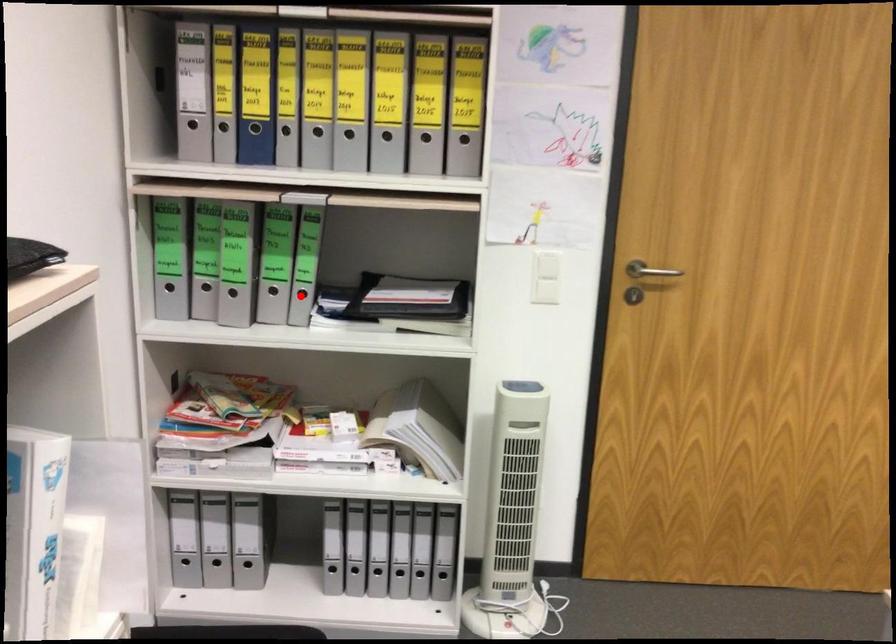
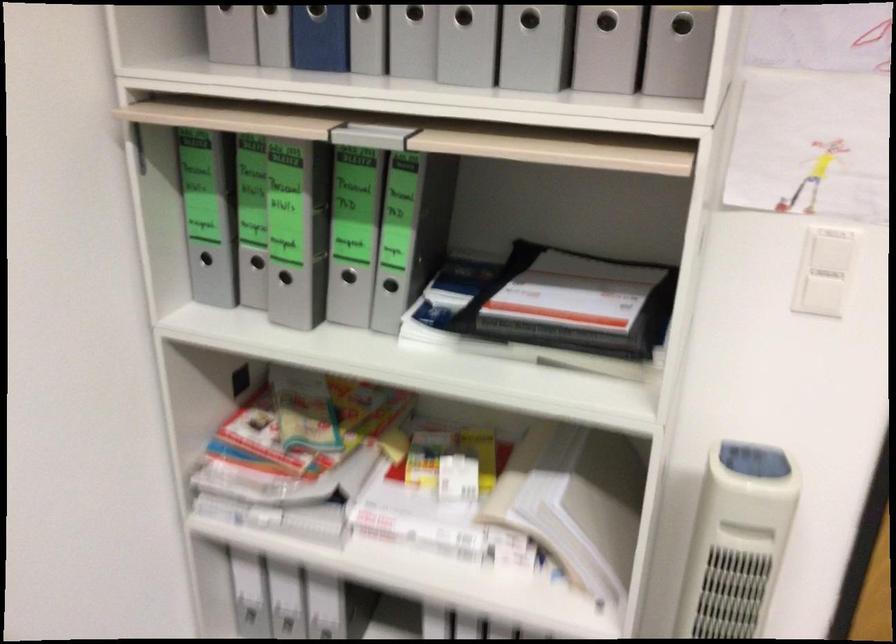
Question: I am providing you with two images of the same scene from different viewpoints. Image1 has a red point marked. In image2, the corresponding 3D location appears at what relative position? Reply with the corresponding letter.

Choices:
 (A) Closer
 (B) Farther

Answer: (A)